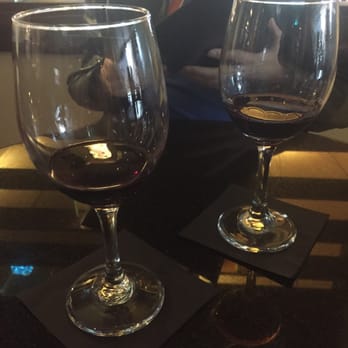
Where is `black napkin`? black napkin is located at coordinates (183, 293), (278, 263).